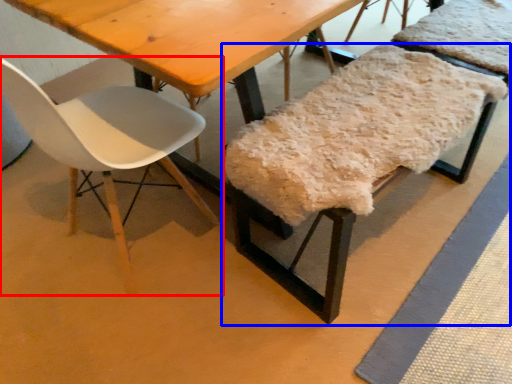
Question: Among these objects, which one is nearest to the camera, chair (highlighted by a red box) or chair (highlighted by a blue box)?

Choices:
 (A) chair
 (B) chair

Answer: (A)